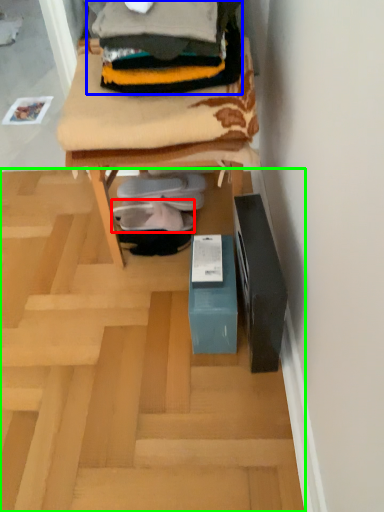
Question: Estimate the real-world distances between objects in this image. Which object is closer to footwear (highlighted by a red box), clothing (highlighted by a blue box) or furnurniture (highlighted by a green box)?

Choices:
 (A) clothing
 (B) furnurniture

Answer: (B)